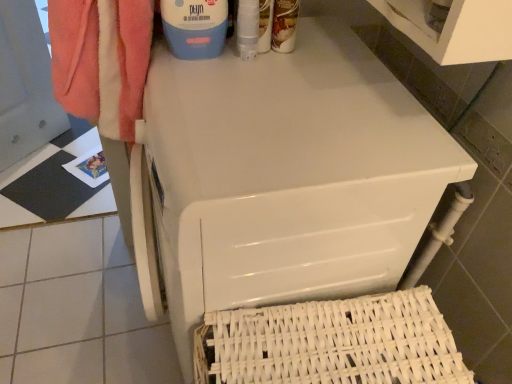
Where is `spots to the right of blue plastic container at upper center, acting as the 2th cleaning product starting from the right`? Image resolution: width=512 pixels, height=384 pixels. spots to the right of blue plastic container at upper center, acting as the 2th cleaning product starting from the right is located at coordinates (276, 60).